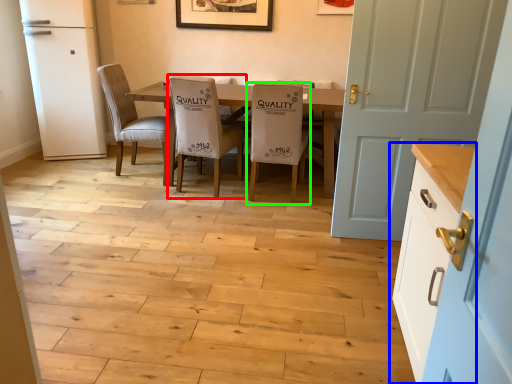
Question: Estimate the real-world distances between objects in this image. Which object is closer to chair (highlighted by a red box), cabinetry (highlighted by a blue box) or chair (highlighted by a green box)?

Choices:
 (A) cabinetry
 (B) chair

Answer: (B)